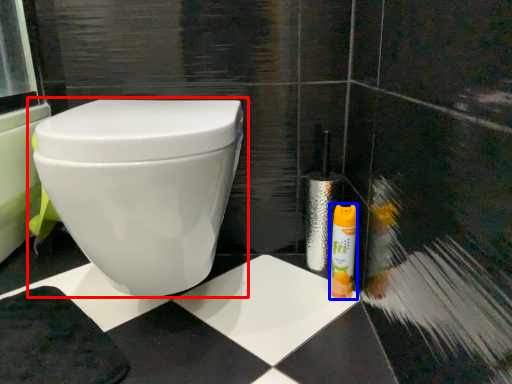
Question: Among these objects, which one is farthest to the camera, toilet (highlighted by a red box) or cleaning product (highlighted by a blue box)?

Choices:
 (A) toilet
 (B) cleaning product

Answer: (B)